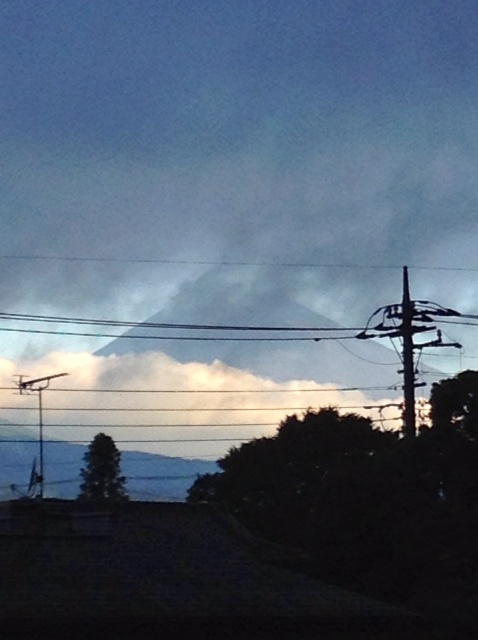
Question: Which object is farther from the camera taking this photo?

Choices:
 (A) black wire at center
 (B) metallic wire at right
 (C) metallic wire at left

Answer: (C)

Question: Which point is closer to the camera?

Choices:
 (A) (304, 330)
 (B) (37, 401)

Answer: (B)

Question: Is black wire at center in front of metallic wire at left?

Choices:
 (A) no
 (B) yes

Answer: (B)

Question: Can you confirm if metallic wire at right is smaller than metallic wire at left?

Choices:
 (A) yes
 (B) no

Answer: (A)

Question: Is metallic wire at right below metallic wire at left?

Choices:
 (A) yes
 (B) no

Answer: (B)

Question: Which object appears farthest from the camera in this image?

Choices:
 (A) metallic wire at left
 (B) black wire at center
 (C) metallic wire at right

Answer: (A)